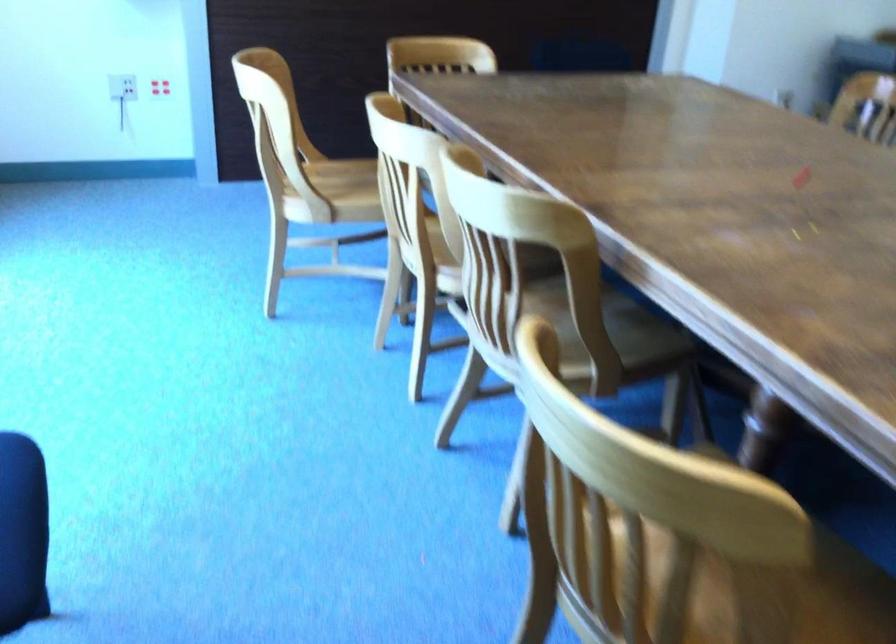
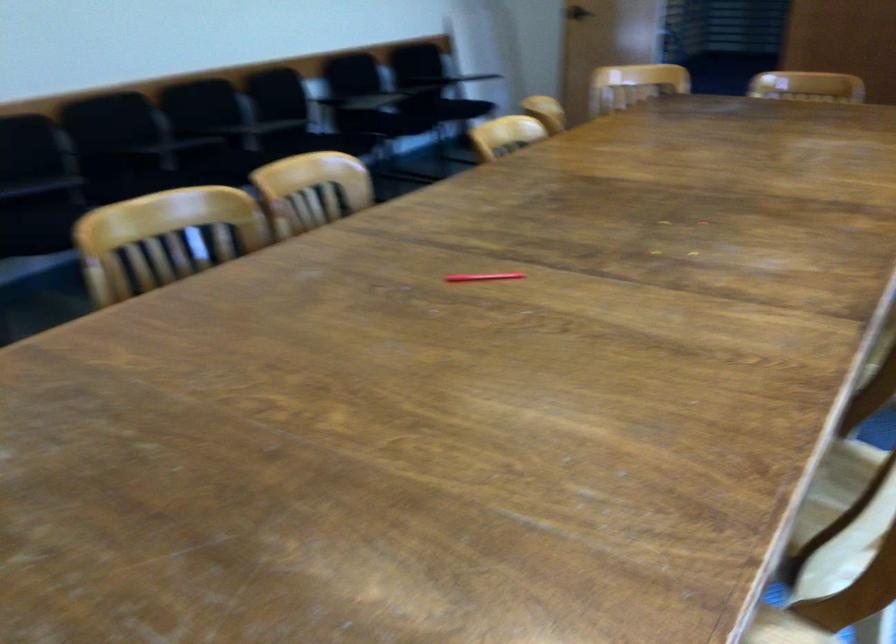
In the second image, find the point that corresponds to [773,184] in the first image.

(486, 279)